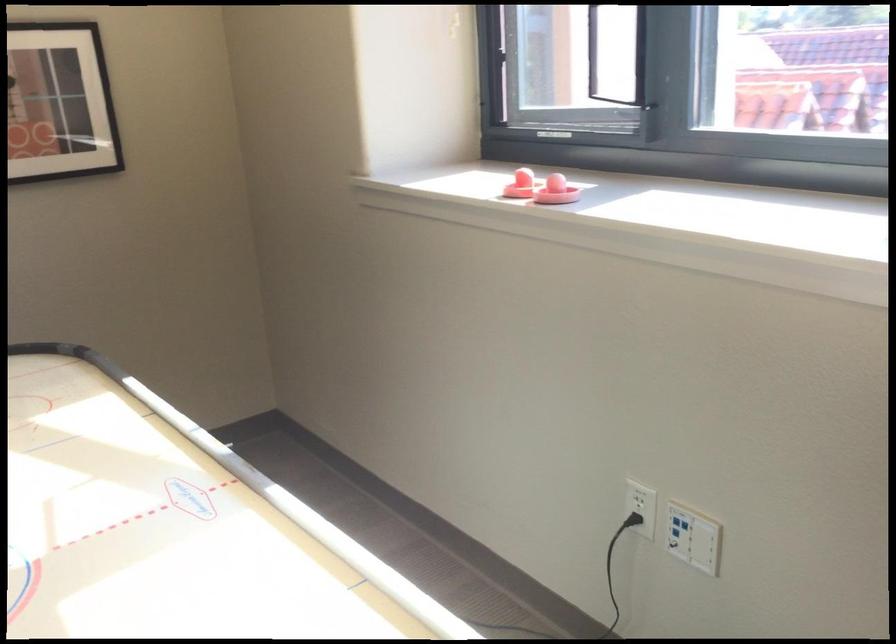
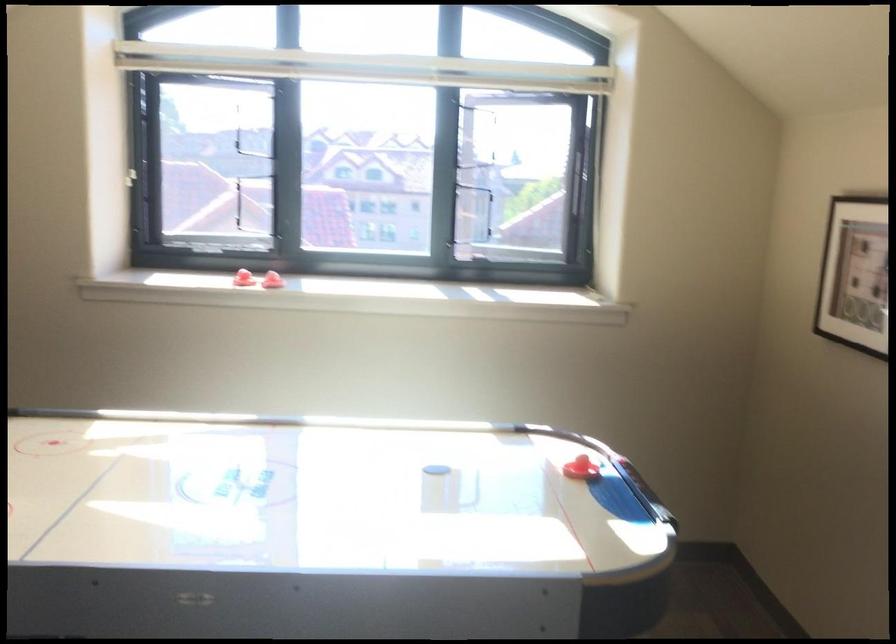
Question: I am providing you with two images of the same scene from different viewpoints. Please identify which objects are invisible in image2.

Choices:
 (A) red air hockey striker
 (B) black air hockey puck
 (C) spring door stop
 (D) black power plug

Answer: (D)